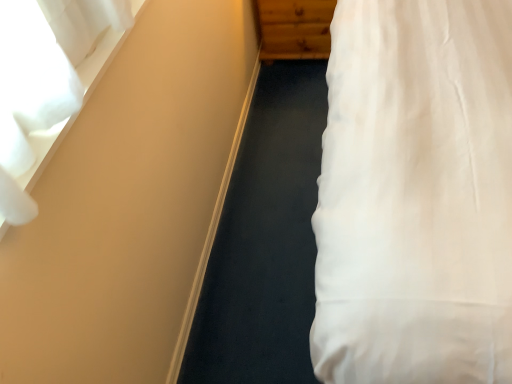
Question: Is wooden dresser at upper center inside or outside of white sheer curtain at upper left?

Choices:
 (A) inside
 (B) outside

Answer: (B)

Question: From the image's perspective, relative to white sheer curtain at upper left, is wooden dresser at upper center above or below?

Choices:
 (A) below
 (B) above

Answer: (B)

Question: Is wooden dresser at upper center wider or thinner than white sheer curtain at upper left?

Choices:
 (A) wide
 (B) thin

Answer: (A)

Question: Considering their positions, is white sheer curtain at upper left located in front of or behind wooden dresser at upper center?

Choices:
 (A) front
 (B) behind

Answer: (A)

Question: In terms of height, does white sheer curtain at upper left look taller or shorter compared to wooden dresser at upper center?

Choices:
 (A) short
 (B) tall

Answer: (A)

Question: Is white sheer curtain at upper left inside the boundaries of wooden dresser at upper center, or outside?

Choices:
 (A) outside
 (B) inside

Answer: (A)

Question: Is white sheer curtain at upper left wider or thinner than wooden dresser at upper center?

Choices:
 (A) thin
 (B) wide

Answer: (A)